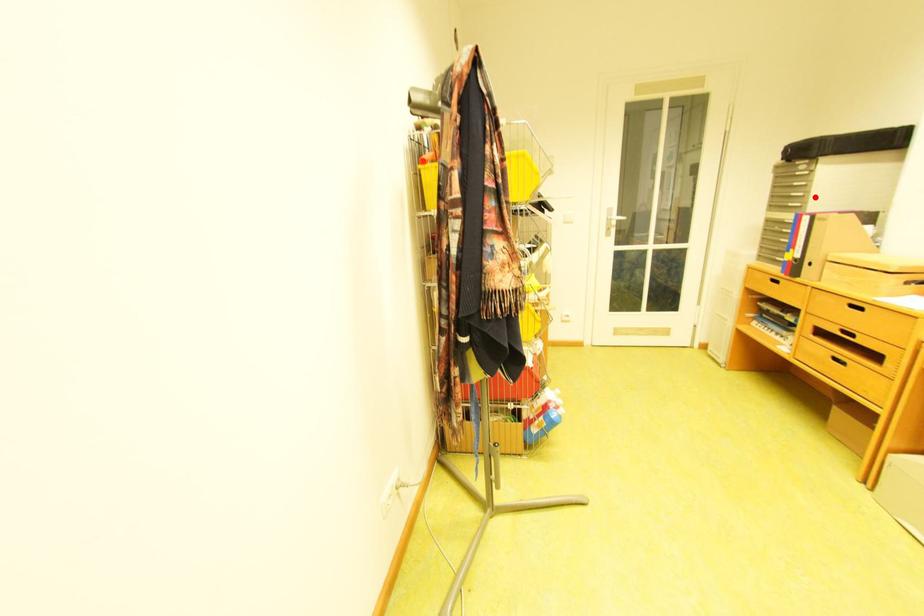
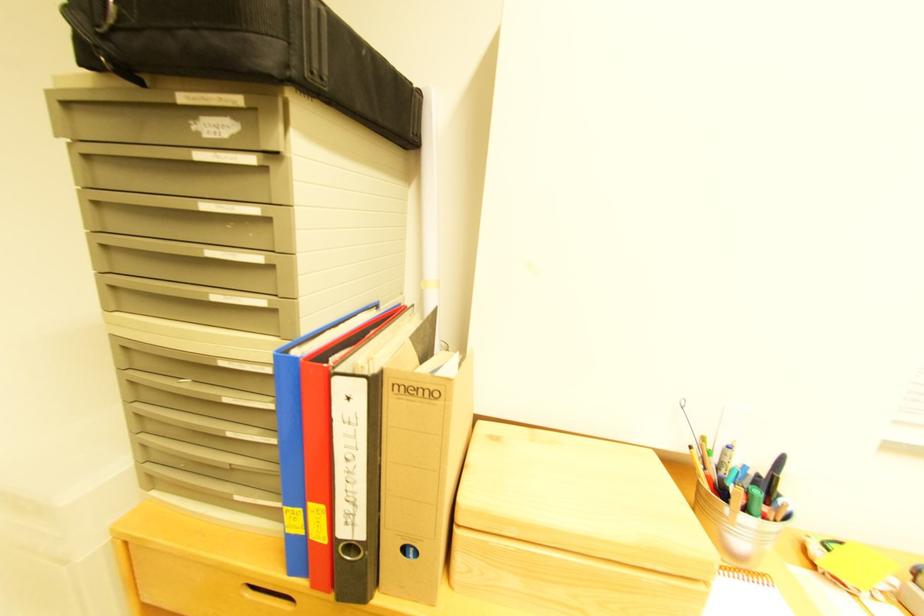
In the second image, find the point that corresponds to the highlighted location in the first image.

(282, 268)